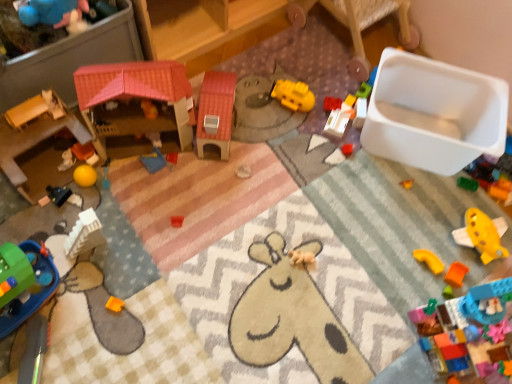
This screenshot has width=512, height=384. Find the location of `free space between black plastic toy at lower left, arranged as the 3th toy when viewed from the left, and translucent blue plastic blocks at lower right, the thirteenth toy viewed from the left`. free space between black plastic toy at lower left, arranged as the 3th toy when viewed from the left, and translucent blue plastic blocks at lower right, the thirteenth toy viewed from the left is located at coordinates (271, 277).